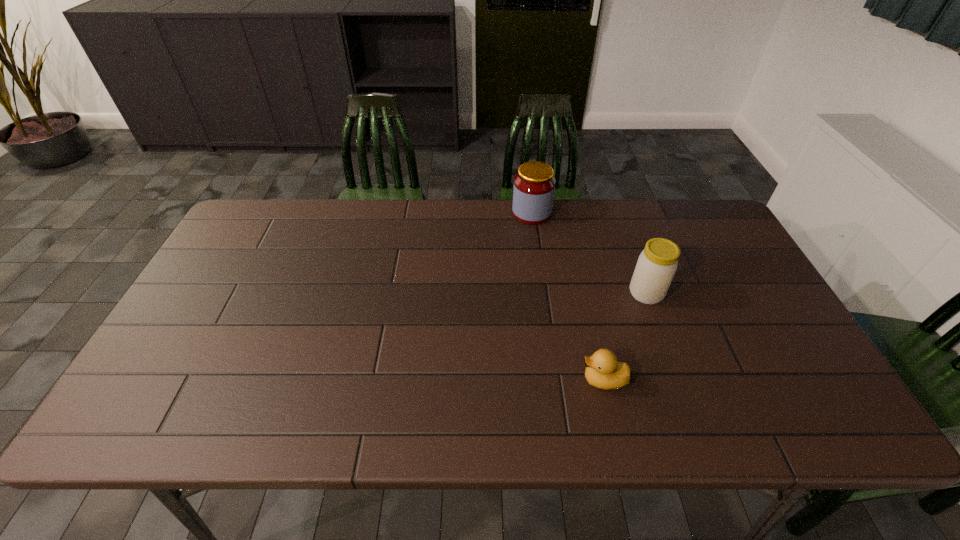
You are a GUI agent. You are given a task and a screenshot of the screen. Output one action in this format:
    pyautogui.click(x=<x>, y=<y>)
    Task: Click on the blank space located on the face of the shortest object
    
    Given the screenshot: What is the action you would take?
    pyautogui.click(x=485, y=380)

This screenshot has width=960, height=540. What are the coordinates of `object located in the far edge section of the desktop` in the screenshot? It's located at (534, 185).

This screenshot has height=540, width=960. I want to click on free space at the far edge of the desktop, so click(489, 228).

The width and height of the screenshot is (960, 540). In order to click on vacant space at the near edge in this screenshot , I will do `click(500, 421)`.

In the image, there is a desktop. Where is `free region at the left edge`? The width and height of the screenshot is (960, 540). free region at the left edge is located at coordinates (238, 254).

Where is `vacant space at the right edge of the desktop`? The height and width of the screenshot is (540, 960). vacant space at the right edge of the desktop is located at coordinates [737, 302].

Identify the location of vacant space that's between the rightmost object and the left jar. (588, 253).

Locate an element on the screen. The height and width of the screenshot is (540, 960). vacant space that is in between the nearer jar and the nearest object is located at coordinates (625, 336).

Locate an element on the screen. free space between the left jar and the rightmost object is located at coordinates (588, 253).

At what (x,y) coordinates should I click in order to perform the action: click on free space between the nearest object and the right jar. Please return your answer as a coordinate pair (x, y). Looking at the image, I should click on (625, 336).